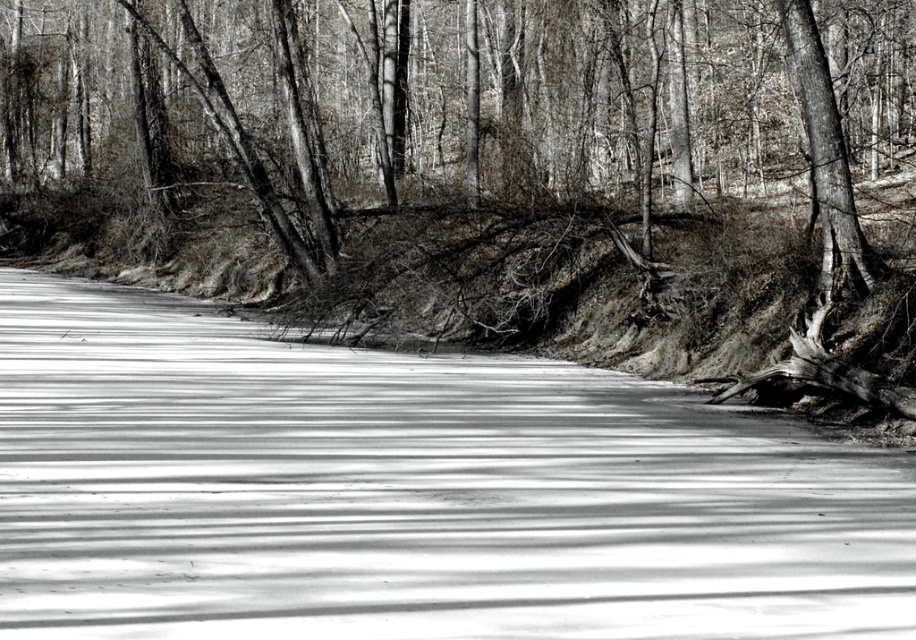
Which is more to the right, smooth bark tree at center or smooth ice at center?

smooth ice at center is more to the right.

You are a GUI agent. You are given a task and a screenshot of the screen. Output one action in this format:
    pyautogui.click(x=<x>, y=<y>)
    Task: Click on the smooth bark tree at center
    
    Given the screenshot: What is the action you would take?
    pyautogui.click(x=492, y=172)